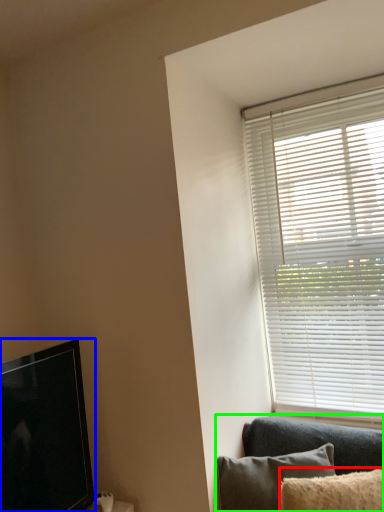
Question: Which object is the closest to the pillow (highlighted by a red box)? Choose among these: television (highlighted by a blue box) or studio couch (highlighted by a green box).

Choices:
 (A) television
 (B) studio couch

Answer: (B)